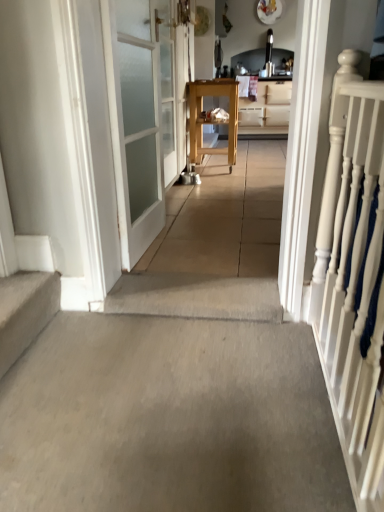
Question: In the image, is wooden cabinet at center on the left side or the right side of white painted wood railing at right?

Choices:
 (A) right
 (B) left

Answer: (A)

Question: From the image's perspective, relative to white painted wood railing at right, is wooden cabinet at center above or below?

Choices:
 (A) above
 (B) below

Answer: (A)

Question: Based on their relative distances, which object is farther from the white frosted glass door at left, arranged as the 1th door when viewed from the front?

Choices:
 (A) wooden cart at center
 (B) wooden cabinet at center
 (C) clear glass door at center, the 1th door from the back
 (D) carpeted stairs at lower left
 (E) white painted wood railing at right

Answer: (B)

Question: Estimate the real-world distances between objects in this image. Which object is closer to the carpeted stairs at lower left?

Choices:
 (A) carpet at center
 (B) wooden cart at center
 (C) wooden cabinet at center
 (D) clear glass door at center, marked as the 2th door in a front-to-back arrangement
 (E) white frosted glass door at left, which ranks as the 2th door in back-to-front order

Answer: (E)